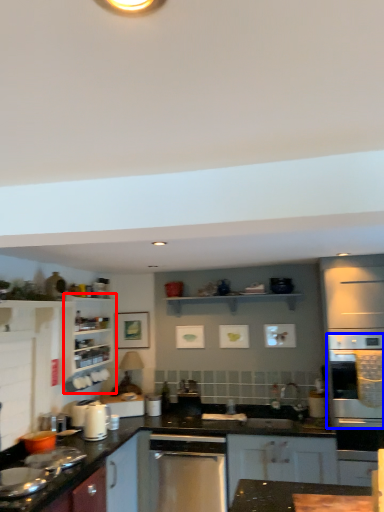
Question: Which point is closer to the camera, cabinetry (highlighted by a red box) or oven (highlighted by a blue box)?

Choices:
 (A) cabinetry
 (B) oven

Answer: (B)